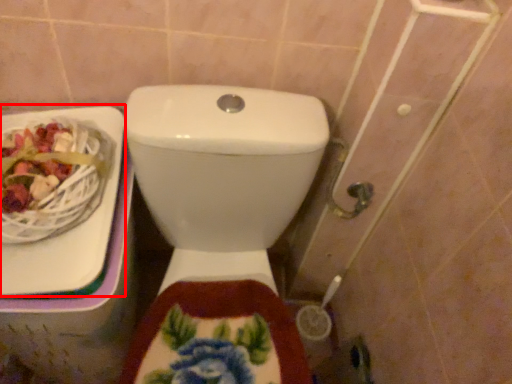
Question: From the image's perspective, where is sink (annotated by the red box) located relative to toilet?

Choices:
 (A) above
 (B) below

Answer: (A)